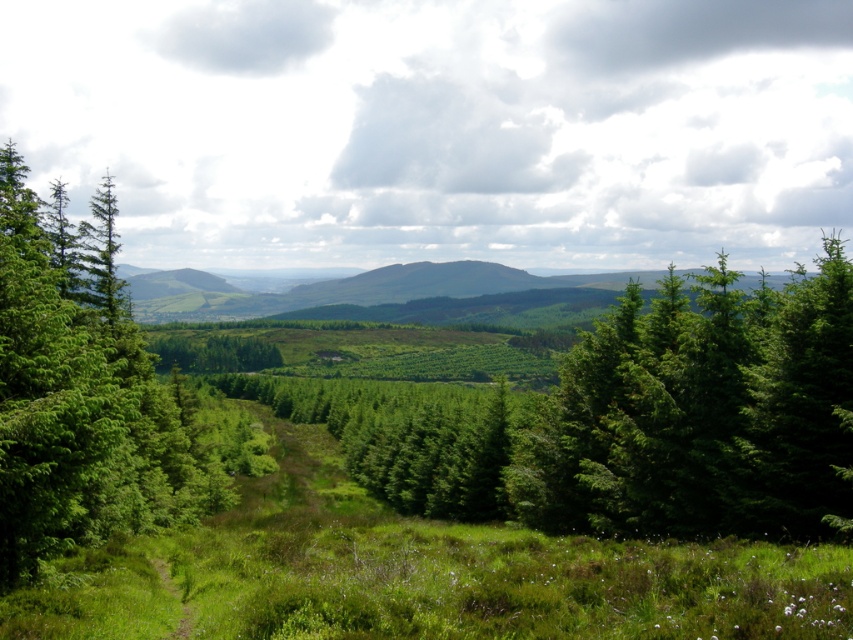
Question: Is green matte tree at center bigger than green leafy tree at left?

Choices:
 (A) no
 (B) yes

Answer: (A)

Question: From the image, what is the correct spatial relationship of green matte tree at center in relation to green leafy tree at left?

Choices:
 (A) left
 (B) right

Answer: (B)

Question: Which of the following is the farthest from the observer?

Choices:
 (A) (189, 465)
 (B) (714, 484)

Answer: (A)

Question: Is green matte tree at center smaller than green leafy tree at left?

Choices:
 (A) yes
 (B) no

Answer: (A)